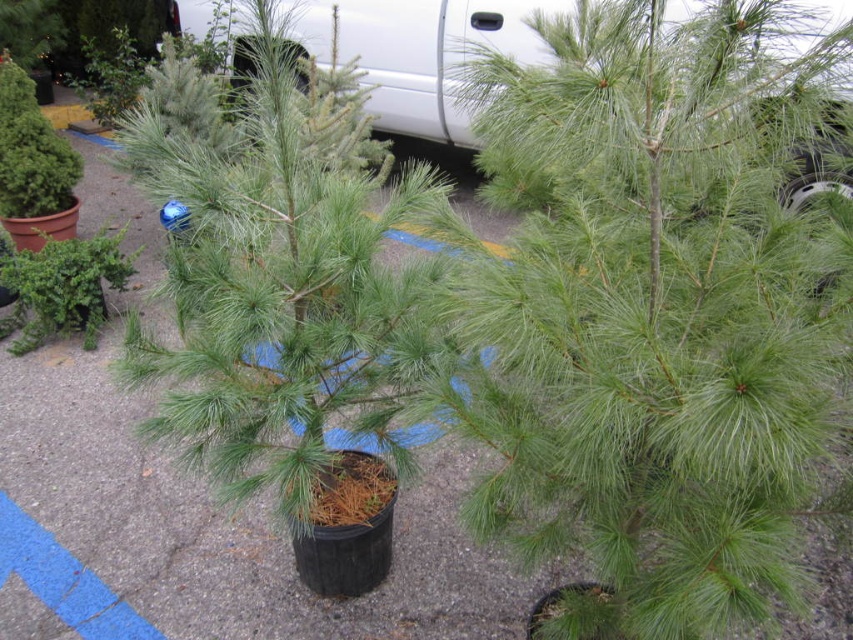
Between green matte tree at center and white matte car at upper center, which one has more height?

With more height is green matte tree at center.

The height and width of the screenshot is (640, 853). Identify the location of green matte tree at center. (654, 312).

Is point (601, 22) farther from camera compared to point (486, 13)?

No, it is in front of (486, 13).

You are a GUI agent. You are given a task and a screenshot of the screen. Output one action in this format:
    pyautogui.click(x=<x>, y=<y>)
    Task: Click on the green matte tree at center
    
    Given the screenshot: What is the action you would take?
    pyautogui.click(x=654, y=312)